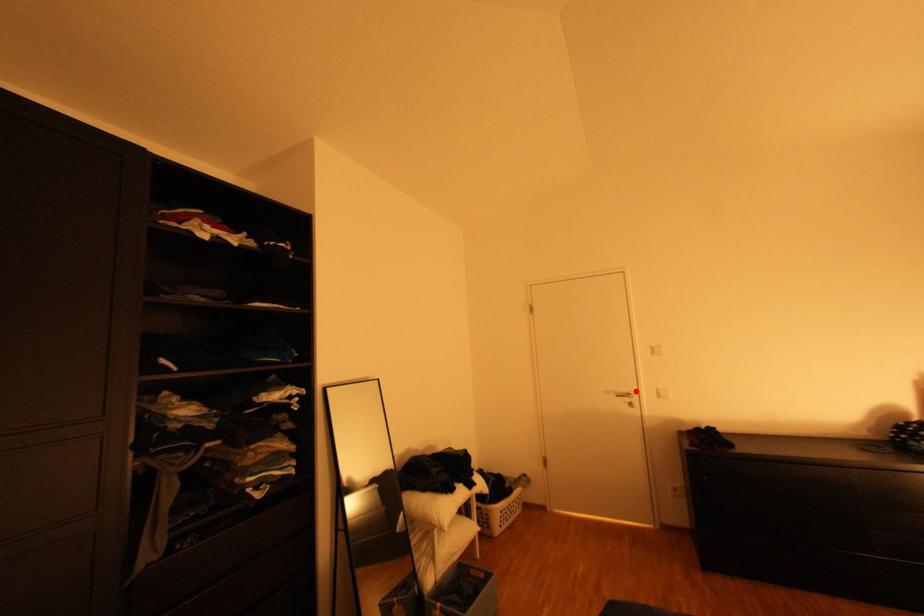
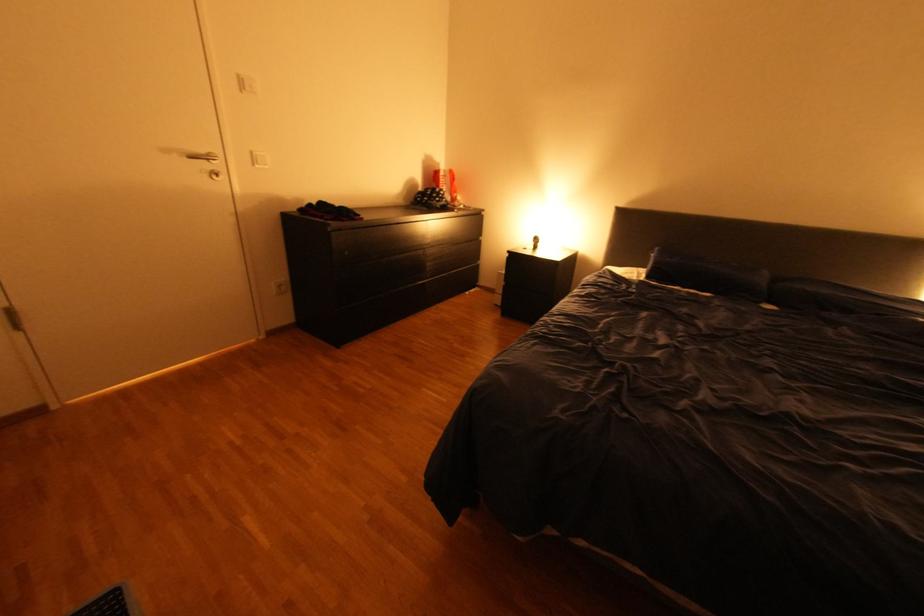
Where in the second image is the point corresponding to the highlighted location from the first image?

(213, 151)